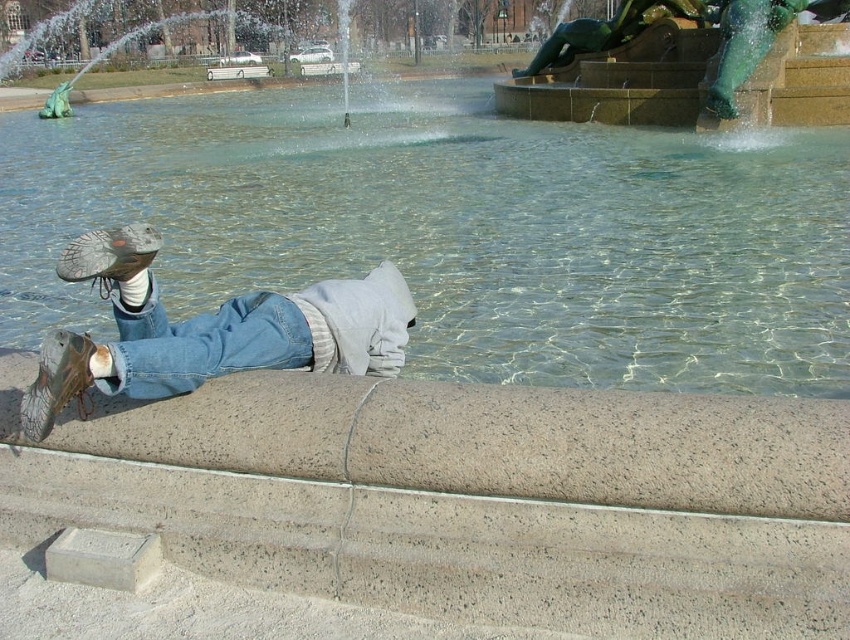
Which is more to the right, clear glass water at lower left or leather shoe at lower left?

clear glass water at lower left

The height and width of the screenshot is (640, 850). I want to click on clear glass water at lower left, so click(x=459, y=230).

Between clear glass water at lower left and denim at lower center, which one appears on the right side from the viewer's perspective?

From the viewer's perspective, clear glass water at lower left appears more on the right side.

Does clear glass water at lower left appear over denim at lower center?

Indeed, clear glass water at lower left is positioned over denim at lower center.

Which is behind, point (10, 230) or point (250, 321)?

Positioned behind is point (10, 230).

Find the location of a particular element. The width and height of the screenshot is (850, 640). clear glass water at lower left is located at coordinates (459, 230).

Is leather shoe at lower left shorter than denim at lower center?

No, leather shoe at lower left is not shorter than denim at lower center.

Does point (157, 244) come closer to viewer compared to point (194, 317)?

Yes, it is.

Describe the element at coordinates (208, 330) in the screenshot. The height and width of the screenshot is (640, 850). I see `leather shoe at lower left` at that location.

Find the location of a particular element. leather shoe at lower left is located at coordinates pos(208,330).